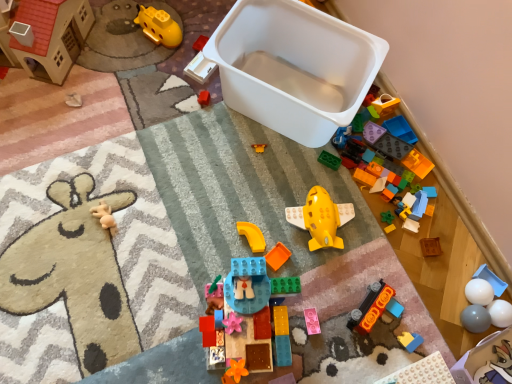
Identify the location of free area in between orange matte car at lower right, marked as the 9th toy in a left-to-right arrangement, and white plastic tray at upper center, acting as the fourth toy starting from the left. The height and width of the screenshot is (384, 512). (283, 192).